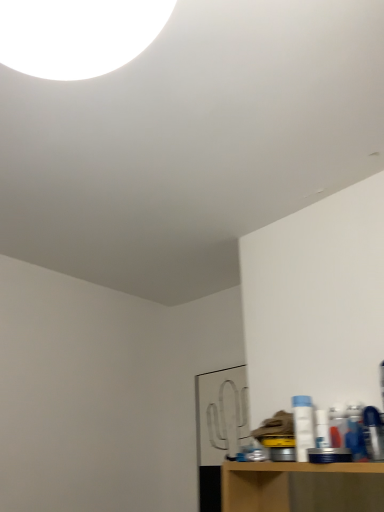
Question: From the image's perspective, is white glossy light at upper center over white plastic bottle at right?

Choices:
 (A) no
 (B) yes

Answer: (B)

Question: Is the surface of white glossy light at upper center in direct contact with white plastic bottle at right?

Choices:
 (A) no
 (B) yes

Answer: (A)

Question: Can you confirm if white glossy light at upper center is wider than white plastic bottle at right?

Choices:
 (A) no
 (B) yes

Answer: (B)

Question: From the image's perspective, is white glossy light at upper center below white plastic bottle at right?

Choices:
 (A) no
 (B) yes

Answer: (A)

Question: Is white glossy light at upper center bigger than white plastic bottle at right?

Choices:
 (A) yes
 (B) no

Answer: (A)

Question: Does white glossy light at upper center appear on the left side of white plastic bottle at right?

Choices:
 (A) yes
 (B) no

Answer: (A)

Question: Is white plastic bottle at right facing away from white glossy light at upper center?

Choices:
 (A) yes
 (B) no

Answer: (B)

Question: Is white plastic bottle at right aimed at white glossy light at upper center?

Choices:
 (A) yes
 (B) no

Answer: (B)

Question: From the image's perspective, is white plastic bottle at right over white glossy light at upper center?

Choices:
 (A) no
 (B) yes

Answer: (A)

Question: Can we say white plastic bottle at right lies outside white glossy light at upper center?

Choices:
 (A) yes
 (B) no

Answer: (A)

Question: Can you confirm if white plastic bottle at right is smaller than white glossy light at upper center?

Choices:
 (A) yes
 (B) no

Answer: (A)

Question: Does white plastic bottle at right have a greater width compared to white glossy light at upper center?

Choices:
 (A) yes
 (B) no

Answer: (B)

Question: From a real-world perspective, relative to white glossy light at upper center, is white plastic bottle at right vertically above or below?

Choices:
 (A) above
 (B) below

Answer: (B)